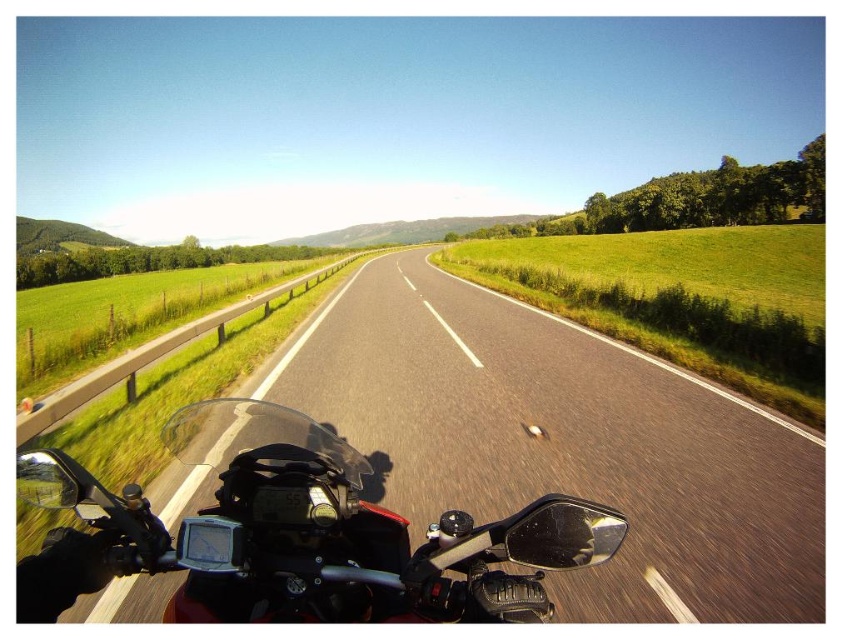
Question: Can you confirm if asphalt road at center is positioned to the left of shiny black motorcycle at center?

Choices:
 (A) no
 (B) yes

Answer: (A)

Question: Which point is closer to the camera taking this photo?

Choices:
 (A) (352, 353)
 (B) (206, 616)

Answer: (B)

Question: Which of the following is the farthest from the observer?

Choices:
 (A) asphalt road at center
 (B) shiny black motorcycle at center

Answer: (A)

Question: Does asphalt road at center have a smaller size compared to shiny black motorcycle at center?

Choices:
 (A) no
 (B) yes

Answer: (A)

Question: Does asphalt road at center have a smaller size compared to shiny black motorcycle at center?

Choices:
 (A) yes
 (B) no

Answer: (B)